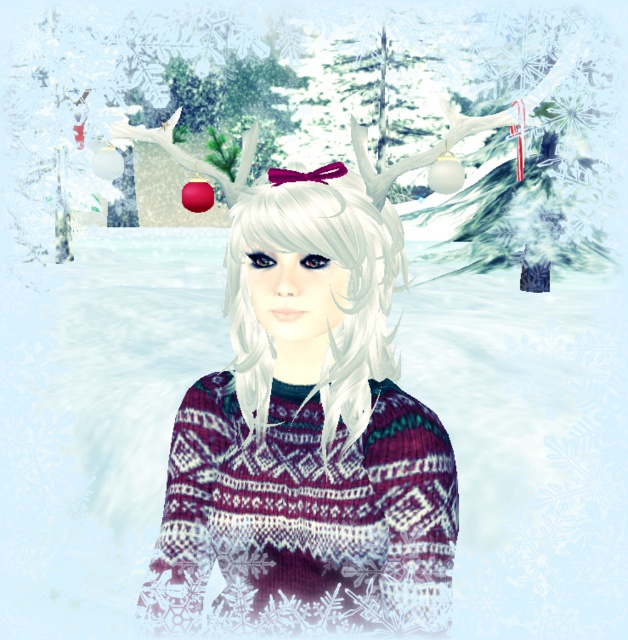
You are trying to decide which sweater to wear for a winter festival. You have two options in the image, the knitted sweater at center and the knitted wool sweater at center. Which one is larger in size?

The knitted sweater at center is bigger than the knitted wool sweater at center, so you should choose the knitted sweater at center if you want a larger size.

You are an observer looking at the character in the image. Which object is closer to you between the knitted wool sweater at center and the white matte hair at center?

The knitted wool sweater at center is closer to you than the white matte hair at center because it is further to the viewer.

You are an observer looking at the character in the winter scene. Which object at the center has a greater width when comparing the knitted wool sweater at center and the white matte hair at center?

The knitted wool sweater at center has a greater width than the white matte hair at center as stated in the description.